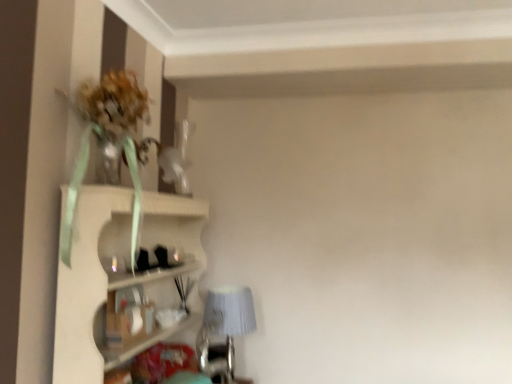
Question: Does point (214, 302) appear closer or farther from the camera than point (153, 271)?

Choices:
 (A) farther
 (B) closer

Answer: (A)

Question: Is textured gray lampshade at lower center bigger or smaller than white textured shelf at upper left?

Choices:
 (A) small
 (B) big

Answer: (A)

Question: In terms of height, does textured gray lampshade at lower center look taller or shorter compared to white textured shelf at upper left?

Choices:
 (A) tall
 (B) short

Answer: (B)

Question: Choose the correct answer: Is white textured shelf at upper left inside textured gray lampshade at lower center or outside it?

Choices:
 (A) outside
 (B) inside

Answer: (A)

Question: Considering the positions of point (94, 365) and point (210, 332), is point (94, 365) closer or farther from the camera than point (210, 332)?

Choices:
 (A) farther
 (B) closer

Answer: (B)

Question: From their relative heights in the image, would you say white textured shelf at upper left is taller or shorter than textured gray lampshade at lower center?

Choices:
 (A) short
 (B) tall

Answer: (B)

Question: Is white textured shelf at upper left in front of or behind textured gray lampshade at lower center in the image?

Choices:
 (A) front
 (B) behind

Answer: (A)